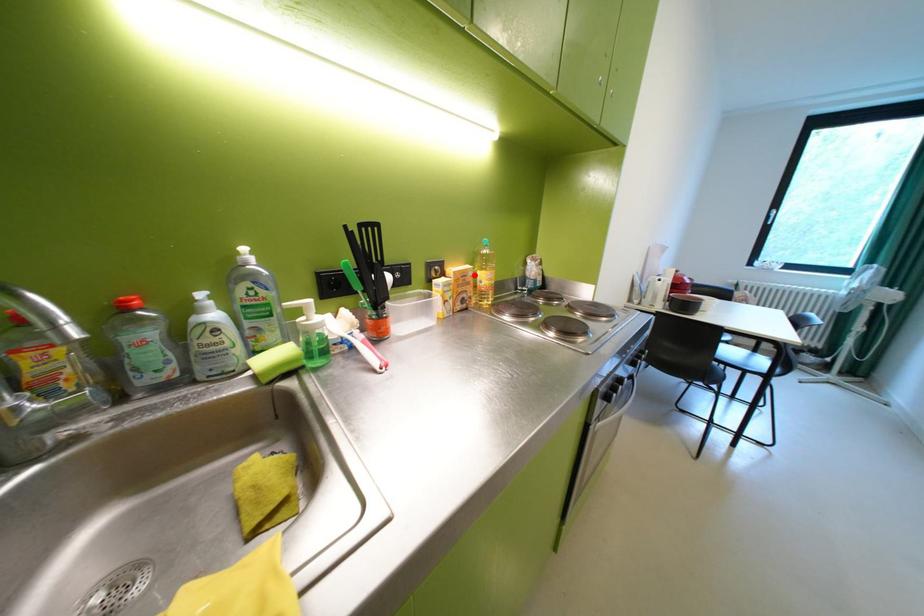
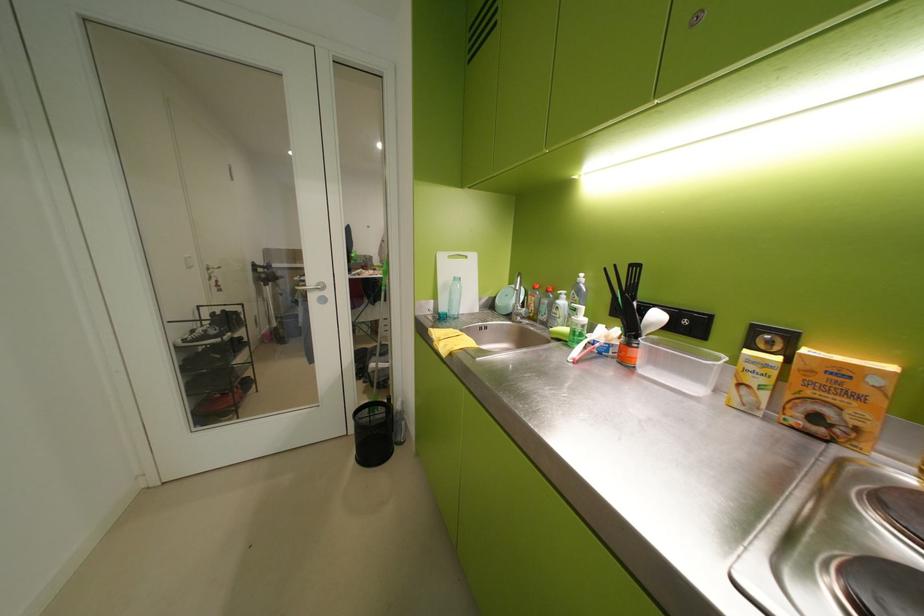
In the second image, find the point that corresponds to the highlighted location in the first image.

(852, 373)